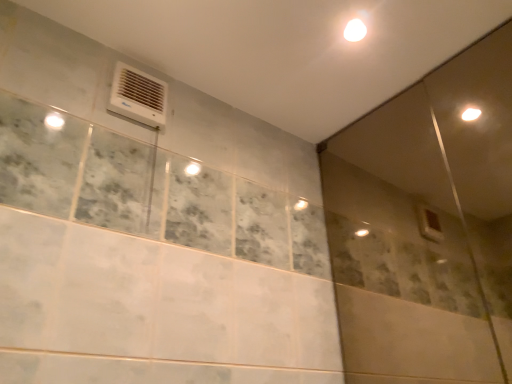
Question: Is white plastic air conditioning unit at upper left completely or partially inside transparent glass screen door at upper right?

Choices:
 (A) no
 (B) yes

Answer: (A)

Question: Is transparent glass screen door at upper right facing towards white plastic air conditioning unit at upper left?

Choices:
 (A) yes
 (B) no

Answer: (A)

Question: Can you see transparent glass screen door at upper right touching white plastic air conditioning unit at upper left?

Choices:
 (A) no
 (B) yes

Answer: (A)

Question: Can you confirm if transparent glass screen door at upper right is taller than white plastic air conditioning unit at upper left?

Choices:
 (A) yes
 (B) no

Answer: (A)

Question: Can you confirm if transparent glass screen door at upper right is shorter than white plastic air conditioning unit at upper left?

Choices:
 (A) no
 (B) yes

Answer: (A)

Question: Does point (381, 117) appear closer or farther from the camera than point (345, 31)?

Choices:
 (A) farther
 (B) closer

Answer: (A)

Question: Would you say transparent glass screen door at upper right is to the left or to the right of white glossy light at upper center in the picture?

Choices:
 (A) left
 (B) right

Answer: (B)

Question: Considering their positions, is transparent glass screen door at upper right located in front of or behind white glossy light at upper center?

Choices:
 (A) behind
 (B) front

Answer: (B)

Question: Do you think transparent glass screen door at upper right is within white glossy light at upper center, or outside of it?

Choices:
 (A) inside
 (B) outside

Answer: (B)

Question: Is point (117, 102) closer or farther from the camera than point (362, 31)?

Choices:
 (A) farther
 (B) closer

Answer: (B)

Question: Looking at the image, does white plastic air conditioning unit at upper left seem bigger or smaller compared to white glossy light at upper center?

Choices:
 (A) small
 (B) big

Answer: (B)

Question: In terms of height, does white plastic air conditioning unit at upper left look taller or shorter compared to white glossy light at upper center?

Choices:
 (A) tall
 (B) short

Answer: (A)

Question: From the image's perspective, is white plastic air conditioning unit at upper left above or below white glossy light at upper center?

Choices:
 (A) above
 (B) below

Answer: (B)

Question: Relative to transparent glass screen door at upper right, is white plastic air conditioning unit at upper left in front or behind?

Choices:
 (A) front
 (B) behind

Answer: (B)

Question: From a real-world perspective, is white plastic air conditioning unit at upper left physically located above or below transparent glass screen door at upper right?

Choices:
 (A) below
 (B) above

Answer: (B)